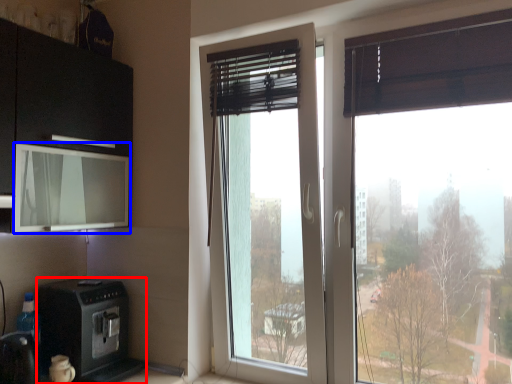
Question: Which object appears closest to the camera in this image, home appliance (highlighted by a red box) or window screen (highlighted by a blue box)?

Choices:
 (A) home appliance
 (B) window screen

Answer: (B)